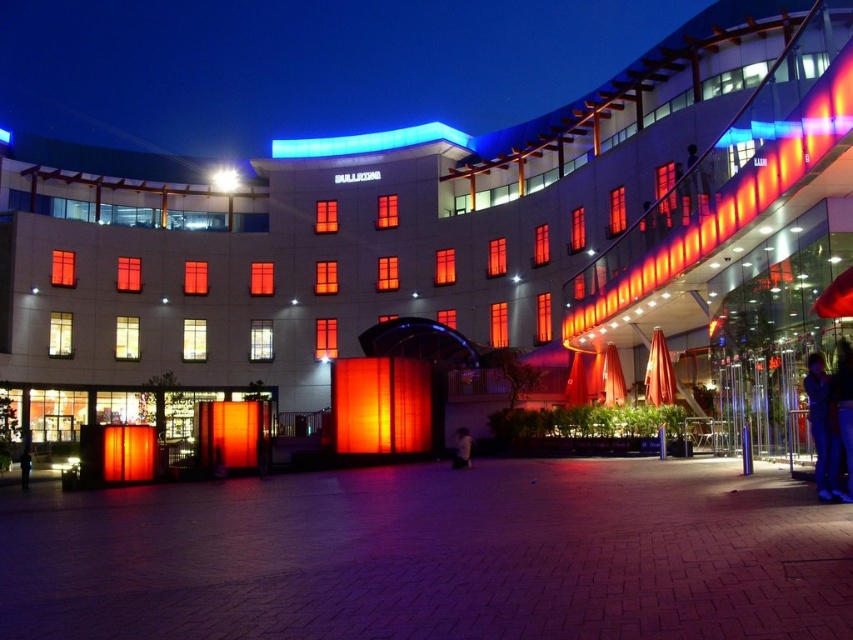
Question: Does blue jeans at lower right come in front of dark blue jeans at lower left?

Choices:
 (A) yes
 (B) no

Answer: (A)

Question: Can you confirm if blue jeans at lower right is thinner than dark blue jeans at lower left?

Choices:
 (A) no
 (B) yes

Answer: (B)

Question: Which object is positioned farthest from the matte orange neon at upper right?

Choices:
 (A) dark blue jeans at lower left
 (B) blue jeans at lower right
 (C) dark blue jeans at lower center

Answer: (A)

Question: Which point is closer to the camera taking this photo?

Choices:
 (A) (461, 436)
 (B) (584, 304)
 (C) (817, 449)

Answer: (C)

Question: Is dark blue jeans at lower center wider than dark blue jeans at lower left?

Choices:
 (A) yes
 (B) no

Answer: (B)

Question: Among these objects, which one is farthest from the camera?

Choices:
 (A) dark blue jeans at lower left
 (B) matte orange neon at upper right
 (C) blue jeans at lower right
 (D) dark blue jeans at lower center

Answer: (A)